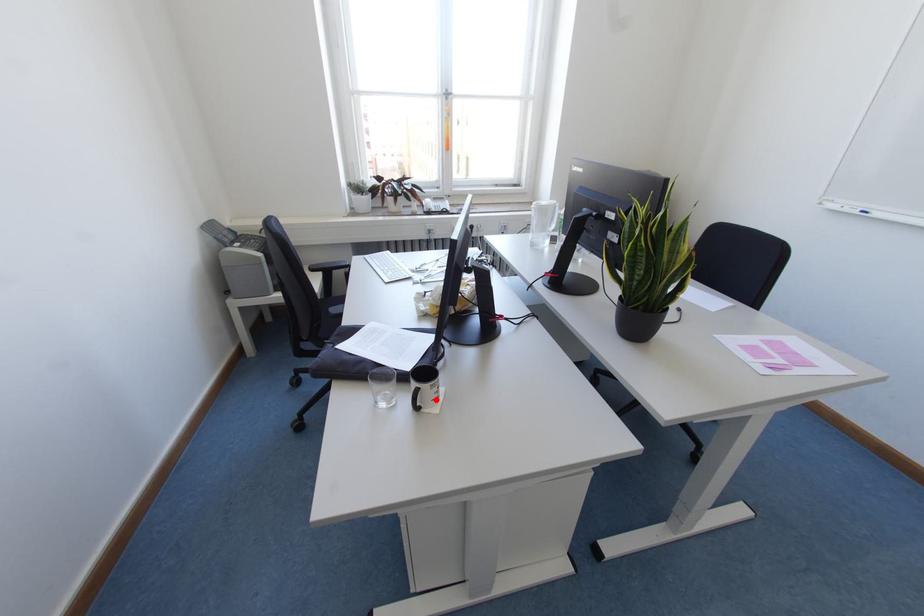
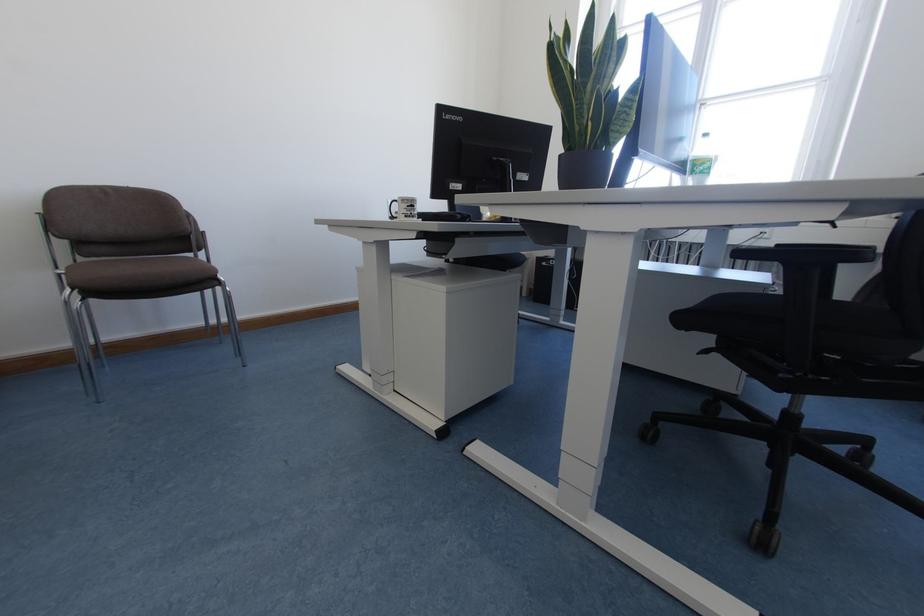
Question: A red point is marked in image1. In image2, is the corresponding 3D point closer to the camera or farther? Reply with the corresponding letter.

Choices:
 (A) The corresponding 3D point is closer.
 (B) The corresponding 3D point is farther.

Answer: (A)